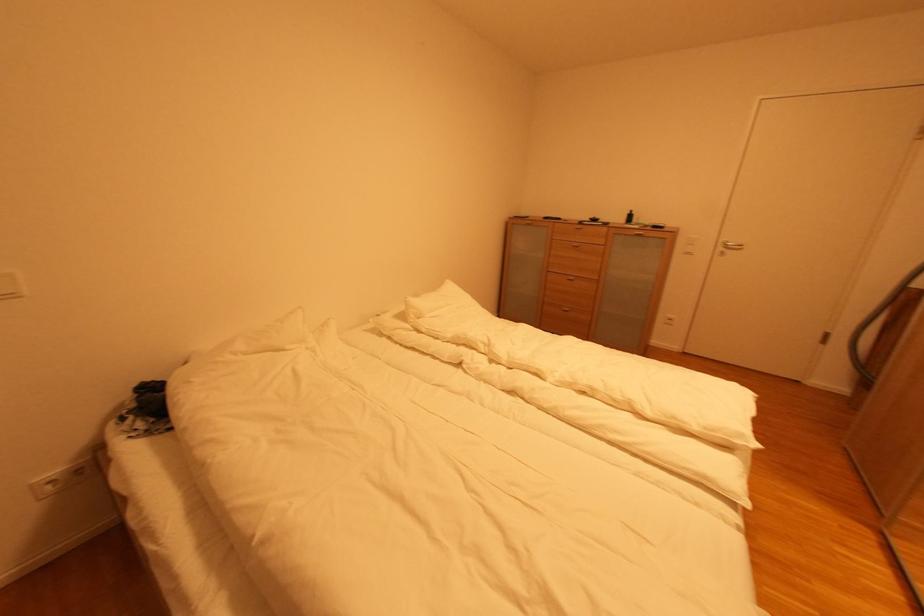
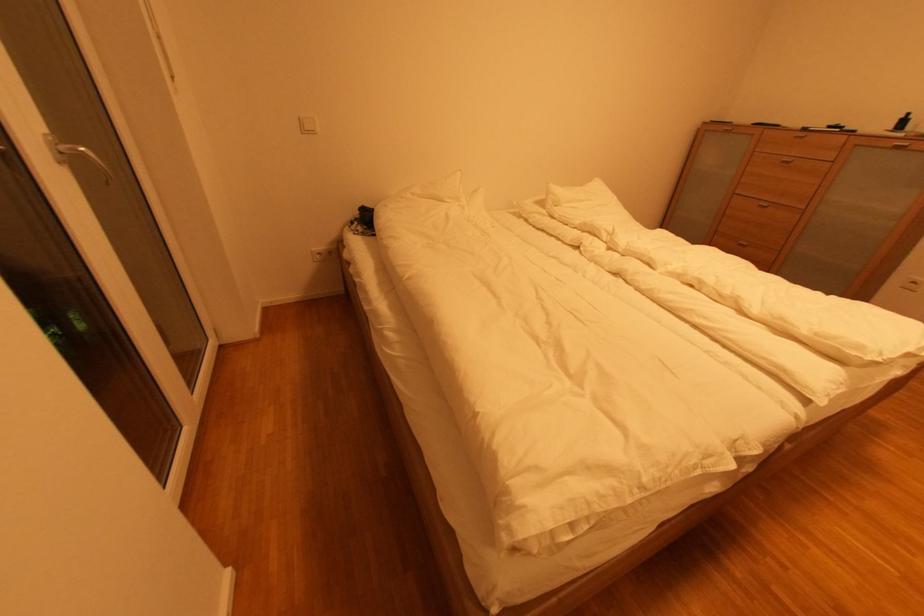
Locate, in the second image, the point that corresponds to (578,281) in the first image.

(772, 208)